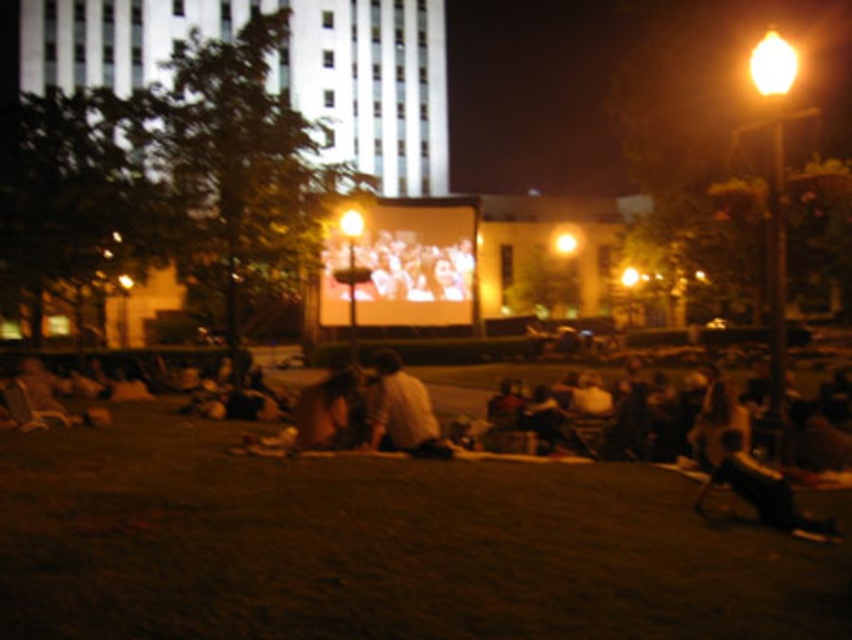
You are attending an outdoor movie night and want to know if your friend wearing a light brown fabric shirt at center can be seen clearly from the matte screen at center. Considering the screen is wider than the shirt, will the shirt be entirely visible on the screen?

The matte screen at center is wider than the light brown fabric shirt at center, so the shirt will be entirely visible on the screen as its width is smaller than the screen.

You are a photographer trying to capture a photo of the matte screen at center and the light brown fabric shirt at center during the outdoor movie event. Based on their sizes in the image, which object should you focus on first to ensure both are in frame without cropping?

The matte screen at center is larger in size than the light brown fabric shirt at center, so you should focus on the matte screen at center first to ensure it fits within the frame, and then adjust to include the smaller light brown fabric shirt at center.